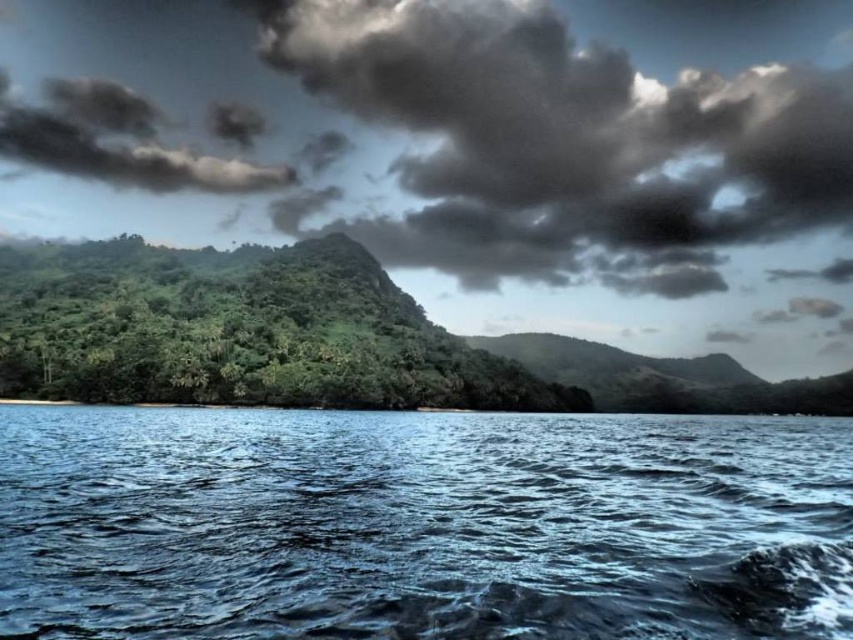
Question: Which of the following is the closest to the observer?

Choices:
 (A) (419, 403)
 (B) (129, 150)
 (C) (616, 86)
 (D) (347, 524)

Answer: (D)

Question: Among these objects, which one is farthest from the camera?

Choices:
 (A) dark gray fluffy cloud at upper center
 (B) green leafy forest at center
 (C) blue liquid water at lower center
 (D) dark gray fluffy cloud at upper left

Answer: (D)

Question: Estimate the real-world distances between objects in this image. Which object is farther from the blue liquid water at lower center?

Choices:
 (A) dark gray fluffy cloud at upper center
 (B) green leafy forest at center
 (C) dark gray fluffy cloud at upper left

Answer: (A)

Question: Does green leafy forest at center have a smaller size compared to dark gray fluffy cloud at upper left?

Choices:
 (A) no
 (B) yes

Answer: (A)

Question: Is blue liquid water at lower center to the left of dark gray fluffy cloud at upper center from the viewer's perspective?

Choices:
 (A) no
 (B) yes

Answer: (B)

Question: Is the position of green leafy forest at center less distant than that of dark gray fluffy cloud at upper left?

Choices:
 (A) no
 (B) yes

Answer: (B)